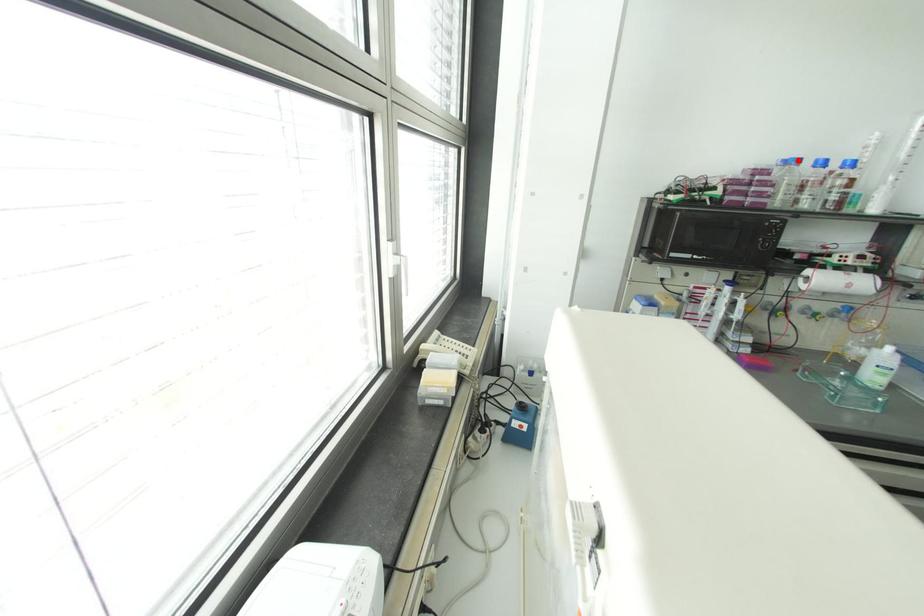
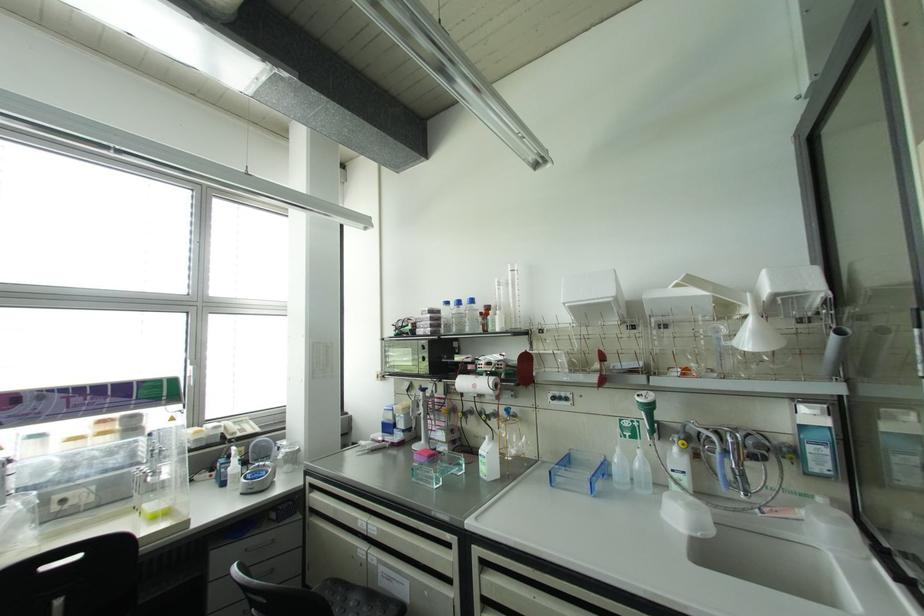
Where in the second image is the point corresponding to the highlighted location from the first image?

(446, 302)